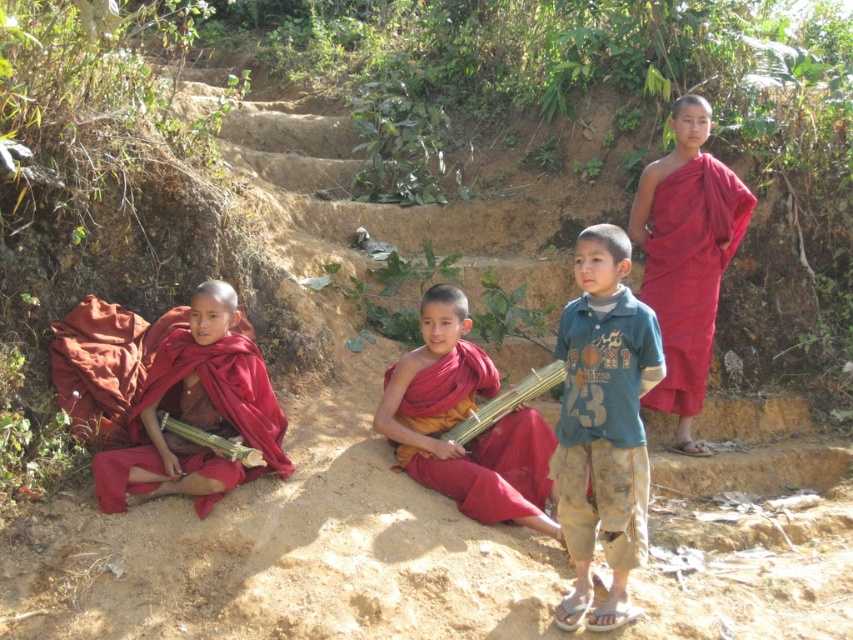
Which is in front, point (585, 596) or point (239, 428)?

Point (585, 596)

Who is more forward, (593, 502) or (184, 376)?

Point (593, 502) is more forward.

Where is `blue cotton shirt at center`? This screenshot has width=853, height=640. blue cotton shirt at center is located at coordinates (602, 426).

Does point (625, 458) come closer to viewer compared to point (444, 387)?

Yes, it is in front of point (444, 387).

Who is taller, blue cotton shirt at center or matte red robe at center?

Standing taller between the two is blue cotton shirt at center.

Between point (576, 388) and point (479, 458), which one is positioned in front?

Point (576, 388) is more forward.

The image size is (853, 640). In order to click on blue cotton shirt at center in this screenshot , I will do `click(602, 426)`.

Does blue cotton shirt at center have a lesser width compared to matte red robe at upper right?

Indeed, blue cotton shirt at center has a lesser width compared to matte red robe at upper right.

Is blue cotton shirt at center bigger than matte red robe at upper right?

Indeed, blue cotton shirt at center has a larger size compared to matte red robe at upper right.

Does point (616, 420) lie in front of point (677, 218)?

That is True.

The width and height of the screenshot is (853, 640). I want to click on blue cotton shirt at center, so click(602, 426).